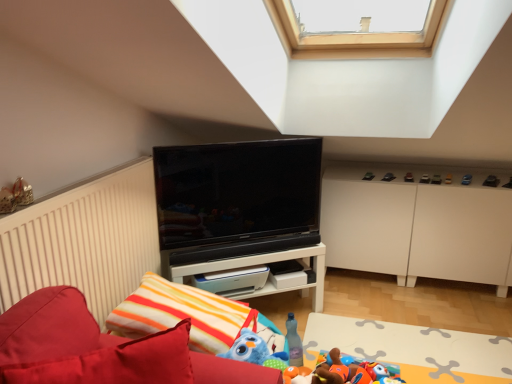
Locate an element on the screen. vacant space behind blue plastic toy at upper right, the fifth toy when ordered from back to front is located at coordinates (460, 172).